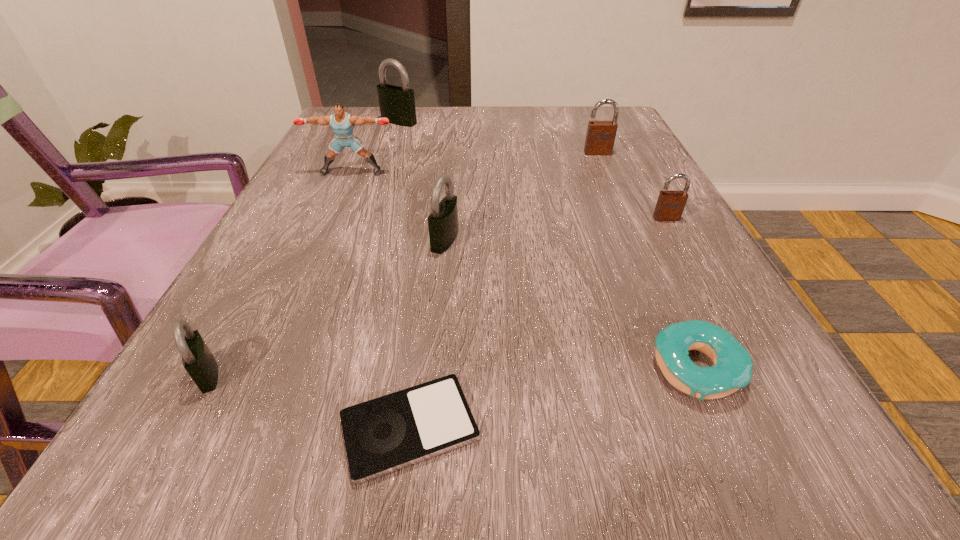
Locate an element on the screen. The width and height of the screenshot is (960, 540). vacant area at the left edge of the desktop is located at coordinates (281, 325).

Where is `free space at the right edge of the desktop`? free space at the right edge of the desktop is located at coordinates (646, 188).

This screenshot has height=540, width=960. I want to click on free point at the near left corner, so click(x=235, y=452).

At what (x,y) coordinates should I click in order to perform the action: click on free point between the seventh tallest object and the third farthest padlock. Please return your answer as a coordinate pair (x, y). The height and width of the screenshot is (540, 960). Looking at the image, I should click on (682, 294).

The width and height of the screenshot is (960, 540). Find the location of `vacant area that lies between the puncher and the fourth nearest padlock`. vacant area that lies between the puncher and the fourth nearest padlock is located at coordinates (475, 162).

This screenshot has width=960, height=540. What are the coordinates of `free spot between the doughnut and the farthest padlock` in the screenshot? It's located at (548, 246).

You are a GUI agent. You are given a task and a screenshot of the screen. Output one action in this format:
    pyautogui.click(x=<x>, y=<y>)
    Task: Click on the free space between the second nearest black padlock and the fifth nearest object
    Image resolution: width=960 pixels, height=540 pixels.
    Given the screenshot: What is the action you would take?
    pos(556,229)

You are a GUI agent. You are given a task and a screenshot of the screen. Output one action in this format:
    pyautogui.click(x=<x>, y=<y>)
    Task: Click on the free space between the leftmost black padlock and the farthest padlock
    
    Given the screenshot: What is the action you would take?
    pyautogui.click(x=303, y=248)

Find the location of a particular element. The width and height of the screenshot is (960, 540). vacant region between the third padlock from right to left and the tallest padlock is located at coordinates (422, 181).

I want to click on free space between the third nearest padlock and the bigger brown padlock, so click(x=632, y=185).